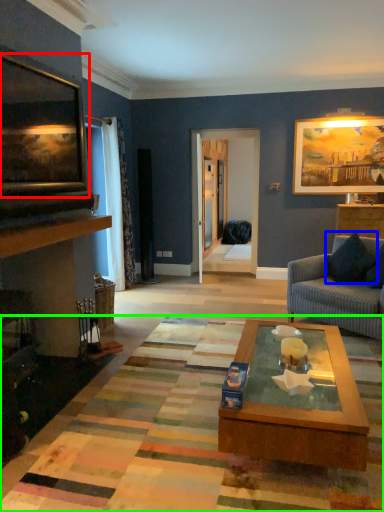
Question: Considering the real-world distances, which object is farthest from picture frame (highlighted by a red box)? pillow (highlighted by a blue box) or mat (highlighted by a green box)?

Choices:
 (A) pillow
 (B) mat

Answer: (A)